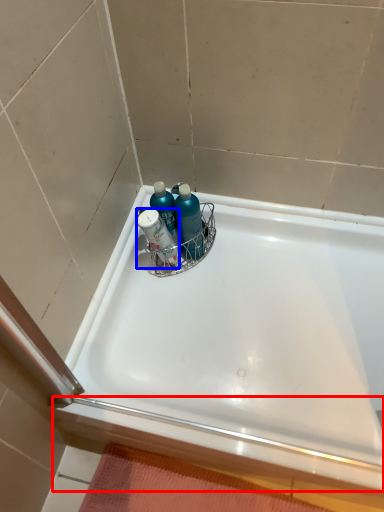
Question: Among these objects, which one is farthest to the camera, ledge (highlighted by a red box) or mouthwash (highlighted by a blue box)?

Choices:
 (A) ledge
 (B) mouthwash

Answer: (B)